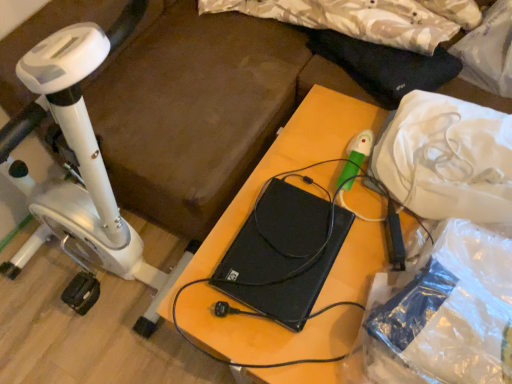
This screenshot has height=384, width=512. What are the coordinates of `free point in front of black matte laptop at center` in the screenshot? It's located at (292, 342).